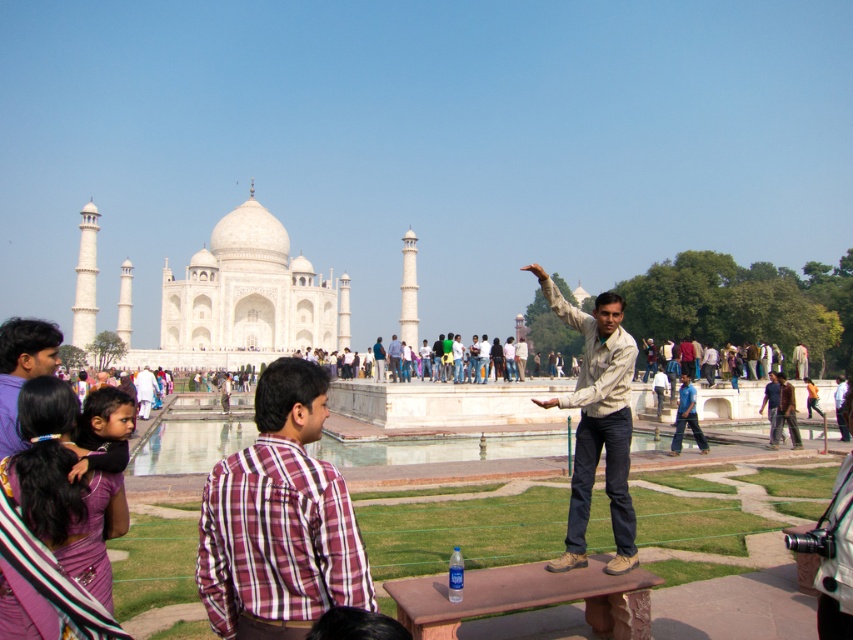
You are a photographer at the Taj Mahal and want to capture both the plaid cotton shirt at center and the light brown cotton shirt at center in your photo. Which shirt should you focus on first if you want to ensure both are clearly visible in the frame?

The plaid cotton shirt at center is larger in size than the light brown cotton shirt at center, so you should focus on the plaid cotton shirt at center first to ensure it fits well in the frame before adjusting for the smaller light brown cotton shirt at center.